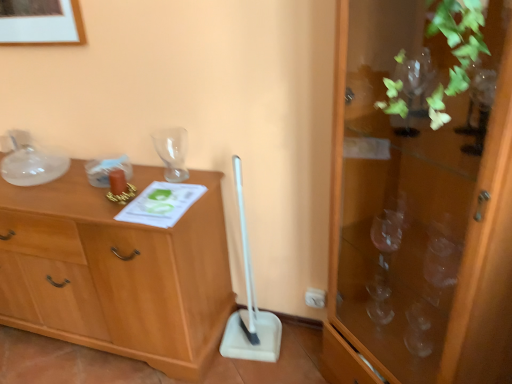
Where is `vacant space situated on the left part of transparent glass vase at upper center`? This screenshot has height=384, width=512. vacant space situated on the left part of transparent glass vase at upper center is located at coordinates (147, 173).